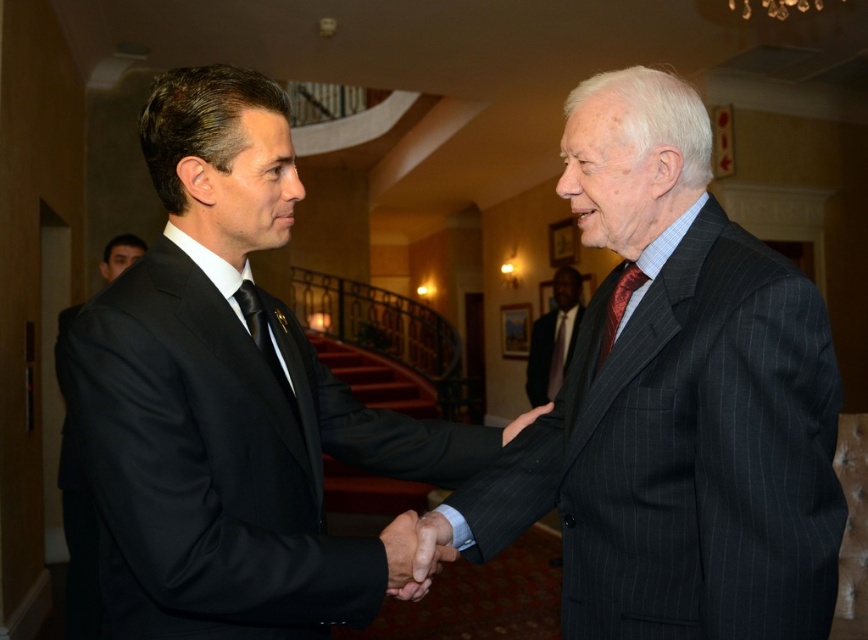
Who is shorter, dark pinstripe suit at center or smooth leather hand at center?

smooth leather hand at center

Does point (570, 314) lie behind point (436, 515)?

Yes, it is behind point (436, 515).

Which is in front, point (531, 336) or point (391, 573)?

Point (391, 573)

Locate an element on the screen. dark pinstripe suit at center is located at coordinates (553, 337).

Between pinstriped suit at center and smooth leather hand at center, which one appears on the left side from the viewer's perspective?

smooth leather hand at center is more to the left.

Looking at this image, can you confirm if pinstriped suit at center is positioned to the right of smooth leather hand at center?

Yes, pinstriped suit at center is to the right of smooth leather hand at center.

Between point (536, 493) and point (398, 557), which one is positioned behind?

Positioned behind is point (536, 493).

Where is `pinstriped suit at center`? The image size is (868, 640). pinstriped suit at center is located at coordinates (676, 403).

Is shiny red tie at center to the right of dark red silk tie at center from the viewer's perspective?

No, shiny red tie at center is not to the right of dark red silk tie at center.

The height and width of the screenshot is (640, 868). I want to click on shiny red tie at center, so click(x=617, y=308).

I want to click on shiny red tie at center, so click(617, 308).